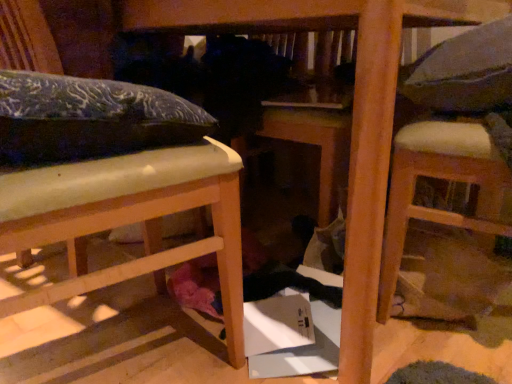
Question: Visually, is matte blue pillow at upper left positioned to the left or to the right of gray fabric pillow at upper right?

Choices:
 (A) right
 (B) left

Answer: (B)

Question: Is matte blue pillow at upper left taller or shorter than gray fabric pillow at upper right?

Choices:
 (A) tall
 (B) short

Answer: (B)

Question: Estimate the real-world distances between objects in this image. Which object is closer to the matte wood bed at left, the first furniture positioned from the left?

Choices:
 (A) gray fabric pillow at upper right
 (B) white padded chair at right, the 2th furniture viewed from the left
 (C) matte blue pillow at upper left

Answer: (C)

Question: Estimate the real-world distances between objects in this image. Which object is farther from the matte blue pillow at upper left?

Choices:
 (A) white padded chair at right, marked as the 1th furniture in a right-to-left arrangement
 (B) matte wood bed at left, the 2th furniture when ordered from right to left
 (C) gray fabric pillow at upper right

Answer: (C)